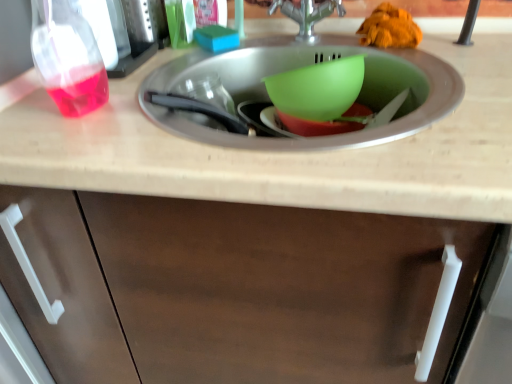
In order to click on empty space that is to the right of transparent plastic bottle at left in this screenshot , I will do `click(158, 115)`.